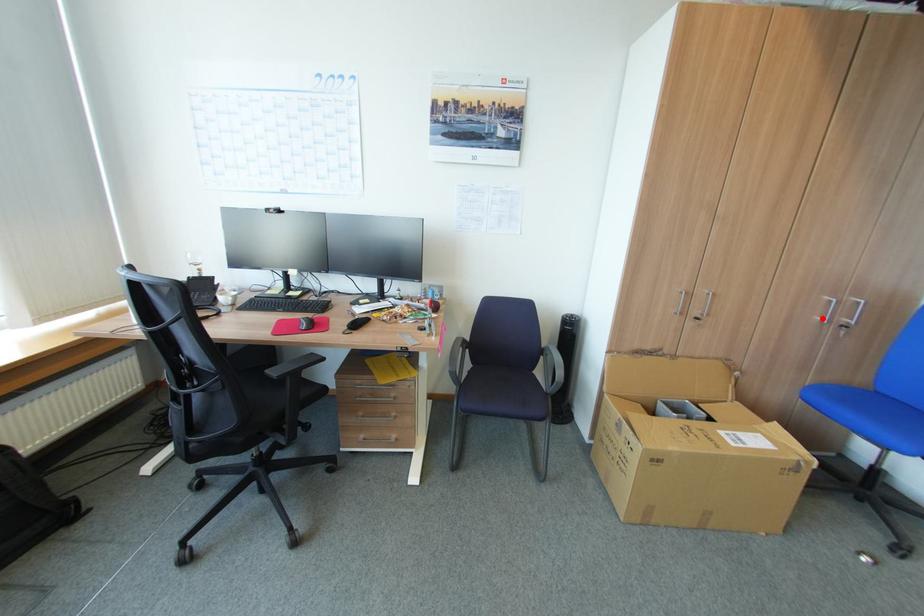
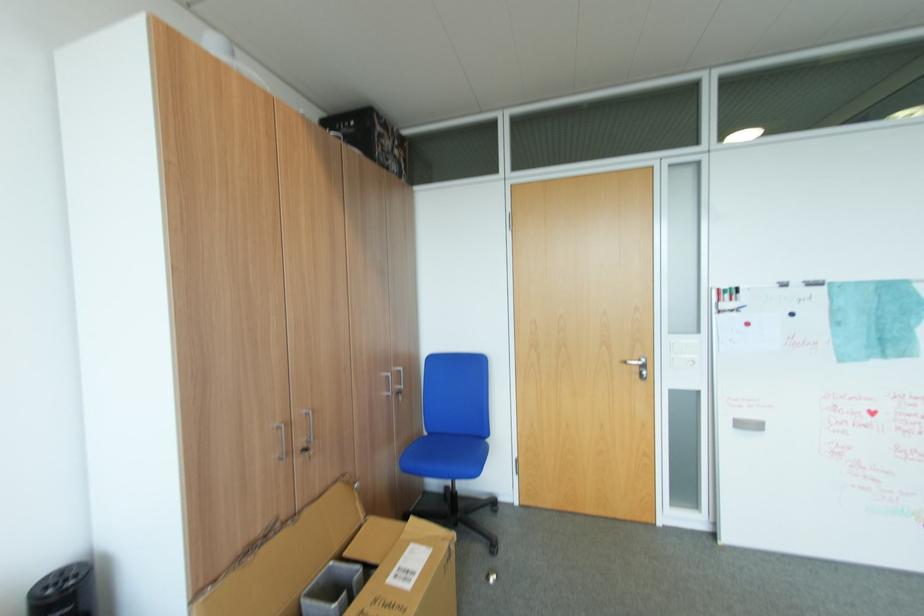
Question: I am providing you with two images of the same scene from different viewpoints. In image1, a red point is highlighted. Considering the same 3D point in image2, which of the following is correct?

Choices:
 (A) It is closer
 (B) It is farther

Answer: (B)